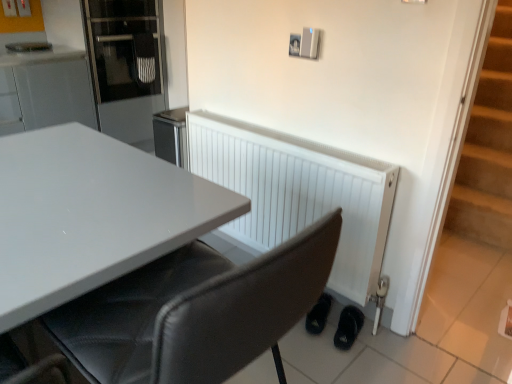
Question: From a real-world perspective, is white matte radiator at lower right located beneath black leather shoes at lower right, the 1th footwear positioned from the left?

Choices:
 (A) no
 (B) yes

Answer: (A)

Question: Is white matte radiator at lower right shorter than black leather shoes at lower right, the 2th footwear from the right?

Choices:
 (A) yes
 (B) no

Answer: (B)

Question: From the image's perspective, is white matte radiator at lower right beneath black leather shoes at lower right, the 2th footwear from the right?

Choices:
 (A) no
 (B) yes

Answer: (A)

Question: Can you see white matte radiator at lower right touching black leather shoes at lower right, the 1th footwear positioned from the left?

Choices:
 (A) yes
 (B) no

Answer: (B)

Question: Does white matte radiator at lower right lie behind black leather shoes at lower right, the 1th footwear positioned from the left?

Choices:
 (A) yes
 (B) no

Answer: (B)

Question: In terms of size, does black leather shoes at lower right, the 2th footwear from the right, appear bigger or smaller than black leather chair at center?

Choices:
 (A) big
 (B) small

Answer: (B)

Question: In terms of width, does black leather shoes at lower right, the 1th footwear positioned from the left, look wider or thinner when compared to black leather chair at center?

Choices:
 (A) thin
 (B) wide

Answer: (A)

Question: Considering their positions, is black leather shoes at lower right, the 1th footwear positioned from the left, located in front of or behind black leather chair at center?

Choices:
 (A) front
 (B) behind

Answer: (B)

Question: From the image's perspective, is black leather shoes at lower right, the 1th footwear positioned from the left, located above or below black leather chair at center?

Choices:
 (A) above
 (B) below

Answer: (B)

Question: From a real-world perspective, relative to black leather shoes at lower right, which is the second footwear from left to right, is glass door refrigerator at upper left vertically above or below?

Choices:
 (A) above
 (B) below

Answer: (A)

Question: In terms of size, does glass door refrigerator at upper left appear bigger or smaller than black leather shoes at lower right, which is counted as the 1th footwear, starting from the right?

Choices:
 (A) small
 (B) big

Answer: (B)

Question: From their relative heights in the image, would you say glass door refrigerator at upper left is taller or shorter than black leather shoes at lower right, which is counted as the 1th footwear, starting from the right?

Choices:
 (A) short
 (B) tall

Answer: (B)

Question: Based on their positions, is glass door refrigerator at upper left located to the left or right of black leather shoes at lower right, which is the second footwear from left to right?

Choices:
 (A) left
 (B) right

Answer: (A)

Question: Does point (103, 306) appear closer or farther from the camera than point (350, 321)?

Choices:
 (A) farther
 (B) closer

Answer: (B)

Question: In terms of size, does black leather chair at center appear bigger or smaller than black leather shoes at lower right, which is the second footwear from left to right?

Choices:
 (A) small
 (B) big

Answer: (B)